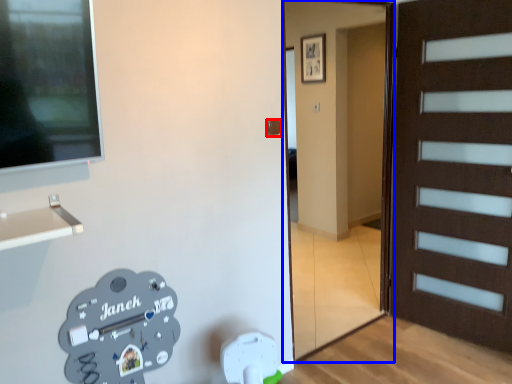
Question: Which object appears closest to the camera in this image, door handle (highlighted by a red box) or garage door (highlighted by a blue box)?

Choices:
 (A) door handle
 (B) garage door

Answer: (B)